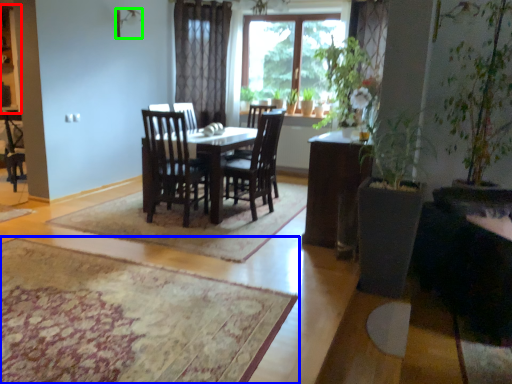
Question: Which object is the farthest from cabinetry (highlighted by a red box)? Choose among these: mat (highlighted by a blue box) or lamp (highlighted by a green box).

Choices:
 (A) mat
 (B) lamp

Answer: (A)